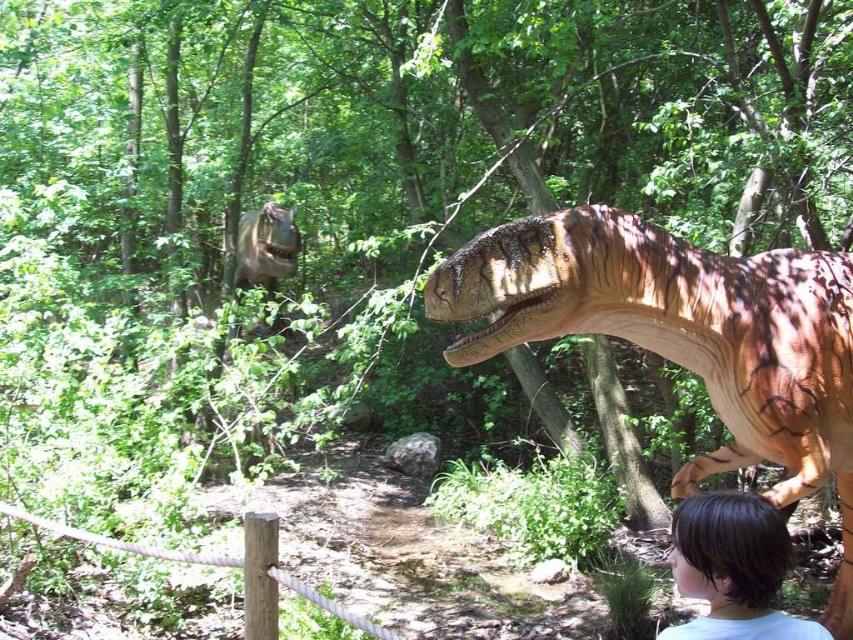
Consider the image. Can you confirm if brown textured dinosaur at center is thinner than brown hair at lower right?

Incorrect, brown textured dinosaur at center's width is not less than brown hair at lower right's.

This screenshot has height=640, width=853. Describe the element at coordinates (683, 337) in the screenshot. I see `brown textured dinosaur at center` at that location.

Is point (718, 266) positioned before point (680, 566)?

That is False.

Image resolution: width=853 pixels, height=640 pixels. I want to click on brown textured dinosaur at center, so click(x=683, y=337).

Is brown textured dinosaur at center further to the viewer compared to shiny metallic dinosaur at upper center?

No, it is in front of shiny metallic dinosaur at upper center.

Who is lower down, brown textured dinosaur at center or shiny metallic dinosaur at upper center?

brown textured dinosaur at center is lower down.

Describe the element at coordinates (683, 337) in the screenshot. The width and height of the screenshot is (853, 640). I see `brown textured dinosaur at center` at that location.

Where is `brown textured dinosaur at center`? The image size is (853, 640). brown textured dinosaur at center is located at coordinates (683, 337).

Does brown textured dinosaur at center have a lesser width compared to brown rough wooden post at lower left?

No, brown textured dinosaur at center is not thinner than brown rough wooden post at lower left.

Between brown textured dinosaur at center and brown rough wooden post at lower left, which one has more height?

brown textured dinosaur at center is taller.

Does point (544, 308) come farther from viewer compared to point (273, 532)?

Yes, it is behind point (273, 532).

Locate an element on the screen. brown textured dinosaur at center is located at coordinates (683, 337).